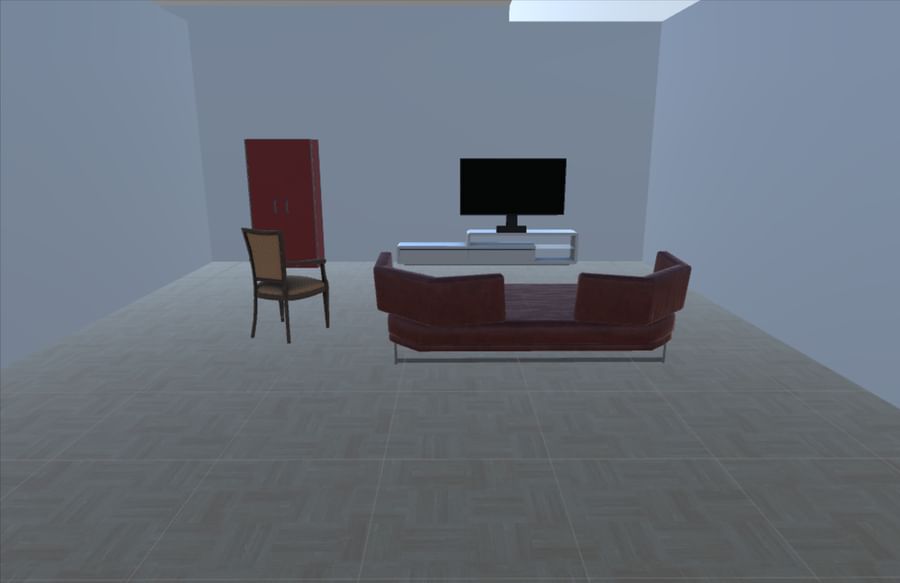
Identify the location of chair. (266, 269).